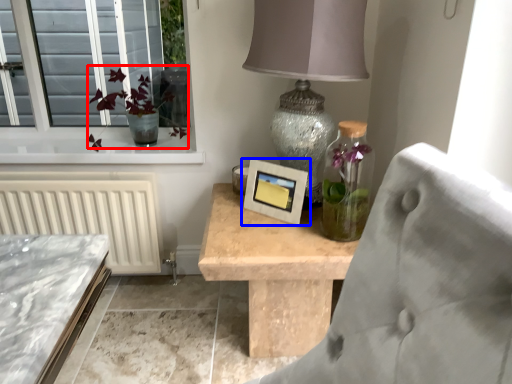
Question: Which point is further to the camera, floral arrangement (highlighted by a red box) or picture frame (highlighted by a blue box)?

Choices:
 (A) floral arrangement
 (B) picture frame

Answer: (A)